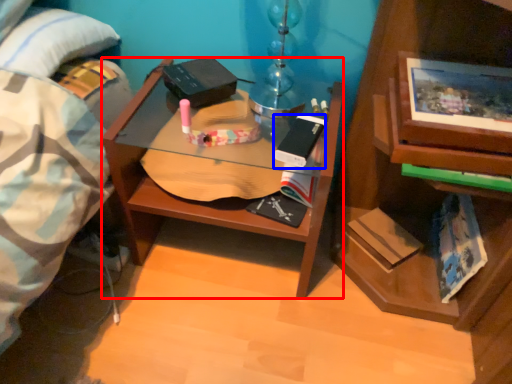
Question: Which of the following is the farthest to the observer, desk (highlighted by a red box) or paperback book (highlighted by a blue box)?

Choices:
 (A) desk
 (B) paperback book

Answer: (B)